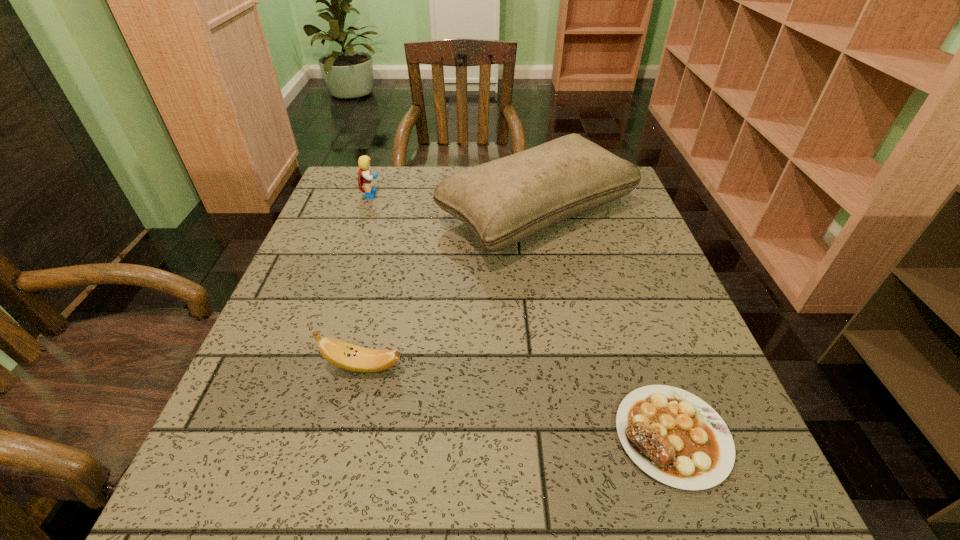
Identify the location of cushion. The width and height of the screenshot is (960, 540). (504, 201).

You are a GUI agent. You are given a task and a screenshot of the screen. Output one action in this format:
    pyautogui.click(x=<x>, y=<y>)
    Task: Click on the Lego
    This screenshot has width=960, height=540.
    Given the screenshot: What is the action you would take?
    pyautogui.click(x=366, y=178)

Locate an element on the screen. the second shortest object is located at coordinates pyautogui.click(x=341, y=354).

The width and height of the screenshot is (960, 540). In order to click on banana in this screenshot , I will do `click(341, 354)`.

I want to click on steak, so click(x=675, y=437).

Where is `the shortest object`? This screenshot has height=540, width=960. the shortest object is located at coordinates (675, 437).

Locate an element on the screen. free region located on the left of the cushion is located at coordinates (327, 212).

The width and height of the screenshot is (960, 540). I want to click on vacant space located on the front-facing side of the Lego, so click(448, 195).

In order to click on vacant space situated on the front of the second nearest object in this screenshot , I will do `click(341, 461)`.

At what (x,y) coordinates should I click in order to perform the action: click on vacant space located 0.330m on the left of the steak. Please return your answer as a coordinate pair (x, y). The height and width of the screenshot is (540, 960). Looking at the image, I should click on (407, 436).